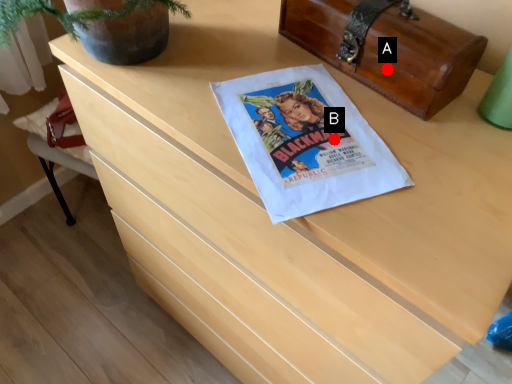
Question: Two points are circled on the image, labeled by A and B beside each circle. Which point appears closest to the camera in this image?

Choices:
 (A) A is closer
 (B) B is closer

Answer: (B)